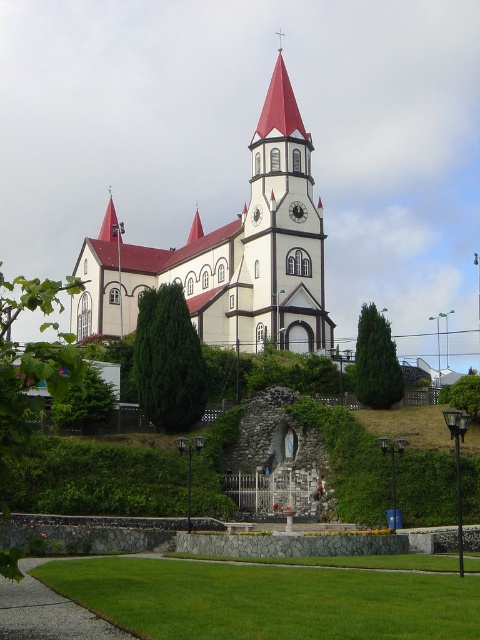
Between smooth red spire at center and metallic clock face at center, which one has less height?

metallic clock face at center

Locate an element on the screen. Image resolution: width=480 pixels, height=640 pixels. smooth red spire at center is located at coordinates (194, 227).

You are a GUI agent. You are given a task and a screenshot of the screen. Output one action in this format:
    pyautogui.click(x=<x>, y=<y>)
    Task: Click on the smooth red spire at center
    
    Given the screenshot: What is the action you would take?
    (194, 227)

Can you confirm if white stone clock tower at center is bigger than metallic clock face at center?

Indeed, white stone clock tower at center has a larger size compared to metallic clock face at center.

Who is lower down, white stone clock tower at center or metallic clock face at center?

metallic clock face at center is below.

The height and width of the screenshot is (640, 480). Describe the element at coordinates (284, 227) in the screenshot. I see `white stone clock tower at center` at that location.

The height and width of the screenshot is (640, 480). I want to click on white stone clock tower at center, so point(284,227).

Is white stone clock tower at center shorter than smooth red spire at upper center?

Incorrect, white stone clock tower at center's height does not fall short of smooth red spire at upper center's.

Is point (249, 221) behind point (122, 225)?

That is False.

You are a GUI agent. You are given a task and a screenshot of the screen. Output one action in this format:
    pyautogui.click(x=<x>, y=<y>)
    Task: Click on the white stone clock tower at center
    Image resolution: width=480 pixels, height=640 pixels.
    Given the screenshot: What is the action you would take?
    pyautogui.click(x=284, y=227)